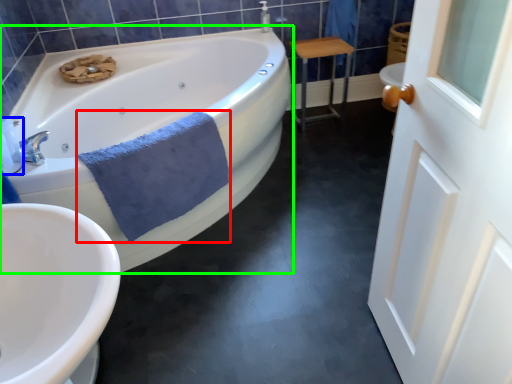
Question: Which object is the closest to the bath towel (highlighted by a red box)? Choose among these: toiletry (highlighted by a blue box) or bathtub (highlighted by a green box).

Choices:
 (A) toiletry
 (B) bathtub

Answer: (A)